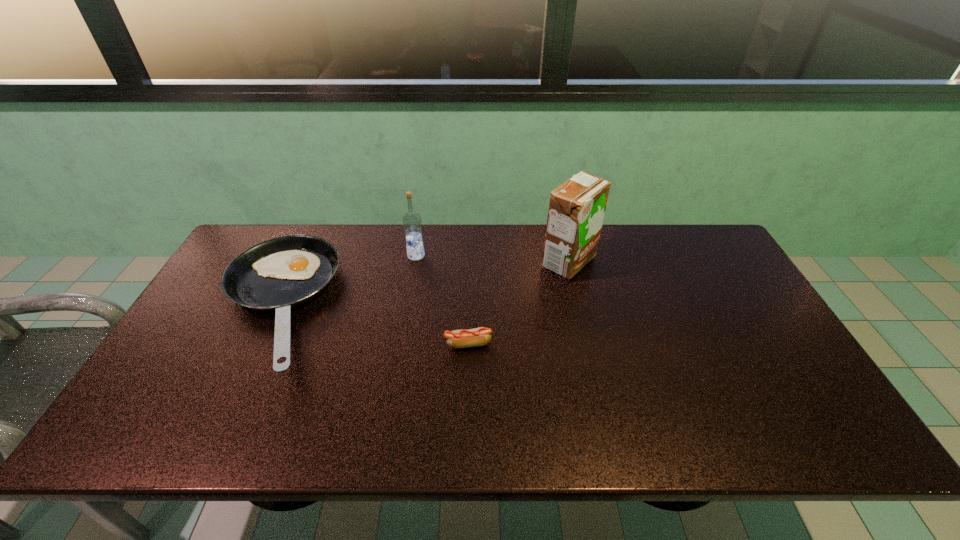
Where is `vacant space located on the straw side of the tallest object`? This screenshot has height=540, width=960. vacant space located on the straw side of the tallest object is located at coordinates (463, 262).

This screenshot has width=960, height=540. I want to click on free region located on the right of the vodka, so click(544, 255).

Find the location of a particular element. Image resolution: width=960 pixels, height=540 pixels. vacant space located 0.190m on the right of the leftmost object is located at coordinates (398, 307).

Identify the location of vacant region located 0.130m on the front of the shortest object. (467, 395).

Identify the location of carton located in the far edge section of the desktop. (577, 207).

At what (x,y) coordinates should I click in order to perform the action: click on vodka present at the far edge. Please return your answer as a coordinate pair (x, y). The height and width of the screenshot is (540, 960). Looking at the image, I should click on (412, 222).

Find the location of `frying pan positioned at the far edge`. frying pan positioned at the far edge is located at coordinates [278, 274].

At what (x,y) coordinates should I click in order to perform the action: click on object that is at the left edge. Please return your answer as a coordinate pair (x, y). This screenshot has height=540, width=960. Looking at the image, I should click on (278, 274).

You are a GUI agent. You are given a task and a screenshot of the screen. Output one action in this format:
    pyautogui.click(x=<x>, y=<y>)
    Task: Click on the object present at the far left corner
    Image resolution: width=960 pixels, height=540 pixels.
    Given the screenshot: What is the action you would take?
    pyautogui.click(x=278, y=274)

You are a GUI agent. You are given a task and a screenshot of the screen. Output one action in this format:
    pyautogui.click(x=<x>, y=<y>)
    Task: Click on the free region at the far edge of the desktop
    The image size is (960, 540).
    Given the screenshot: What is the action you would take?
    pyautogui.click(x=537, y=251)